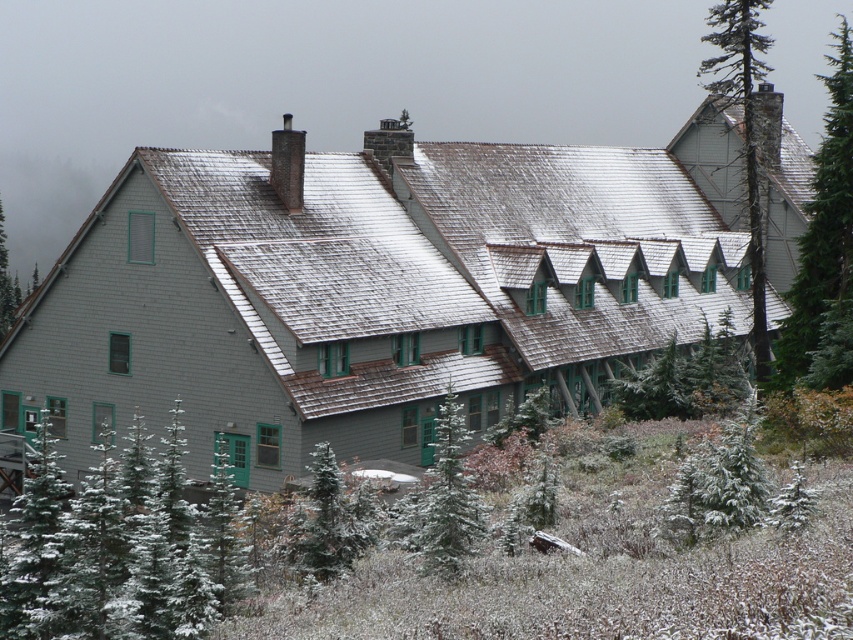
What do you see at coordinates (115, 548) in the screenshot? The width and height of the screenshot is (853, 640). I see `green textured pine tree at lower left` at bounding box center [115, 548].

How much distance is there between green textured pine tree at lower left and green wood tree at upper right?

They are 33.84 meters apart.

The height and width of the screenshot is (640, 853). Describe the element at coordinates (115, 548) in the screenshot. I see `green textured pine tree at lower left` at that location.

Where is `green textured pine tree at lower left`? Image resolution: width=853 pixels, height=640 pixels. green textured pine tree at lower left is located at coordinates (115, 548).

Which is more to the left, green textured pine tree at lower left or smooth bark tree at upper right?

Positioned to the left is green textured pine tree at lower left.

Does point (54, 627) come farther from viewer compared to point (747, 104)?

No.

What are the coordinates of `green textured pine tree at lower left` in the screenshot? It's located at (115, 548).

Is green wood tree at upper right to the right of green textured pine tree at center from the viewer's perspective?

Correct, you'll find green wood tree at upper right to the right of green textured pine tree at center.

Does green wood tree at upper right come in front of green textured pine tree at center?

No, it is not.

Between point (827, 326) and point (444, 406), which one is positioned in front?

Positioned in front is point (444, 406).

The height and width of the screenshot is (640, 853). Identify the location of green wood tree at upper right. click(x=825, y=248).